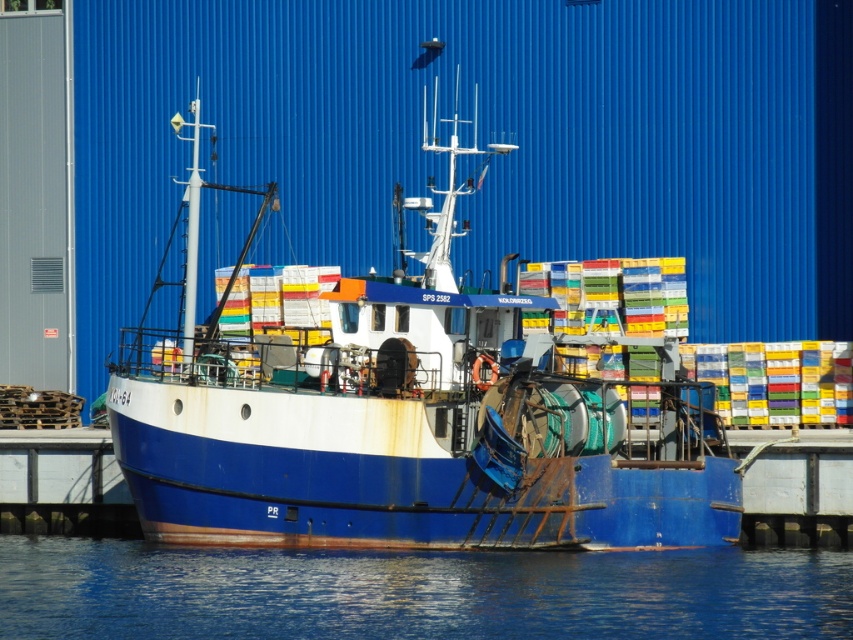
What do you see at coordinates (416, 422) in the screenshot? I see `blue matte boat at center` at bounding box center [416, 422].

Which is above, blue matte boat at center or blue water at lower center?

blue matte boat at center is above.

Is point (665, 545) less distant than point (641, 612)?

No, (665, 545) is further to viewer.

Identify the location of blue matte boat at center. (416, 422).